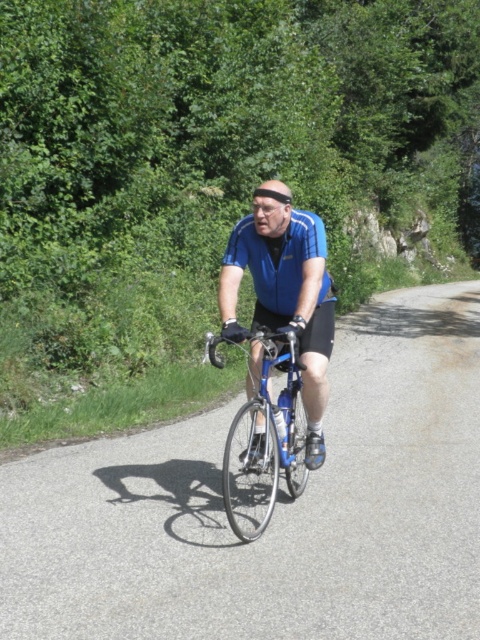
How much distance is there between asphalt road at center and blue matte jersey at center?

asphalt road at center is 2.44 meters from blue matte jersey at center.

Is asphalt road at center thinner than blue matte jersey at center?

Incorrect, asphalt road at center's width is not less than blue matte jersey at center's.

Is point (381, 344) behind point (255, 464)?

Yes.

This screenshot has width=480, height=640. Identify the location of asphalt road at center. (276, 508).

Between blue matte jersey at center and shiny blue frame at center, which one has more height?

Standing taller between the two is blue matte jersey at center.

Does point (303, 266) come behind point (278, 360)?

No, (303, 266) is in front of (278, 360).

At what (x,y) coordinates should I click in order to perform the action: click on blue matte jersey at center. Please return your answer as a coordinate pair (x, y). The height and width of the screenshot is (640, 480). Looking at the image, I should click on (286, 291).

Who is shorter, asphalt road at center or shiny blue frame at center?

Standing shorter between the two is asphalt road at center.

Is asphalt road at center to the left of shiny blue frame at center from the viewer's perspective?

Incorrect, asphalt road at center is not on the left side of shiny blue frame at center.

Between point (334, 372) and point (266, 440), which one is positioned in front?

Point (266, 440)

This screenshot has height=640, width=480. In order to click on asphalt road at center in this screenshot , I will do `click(276, 508)`.